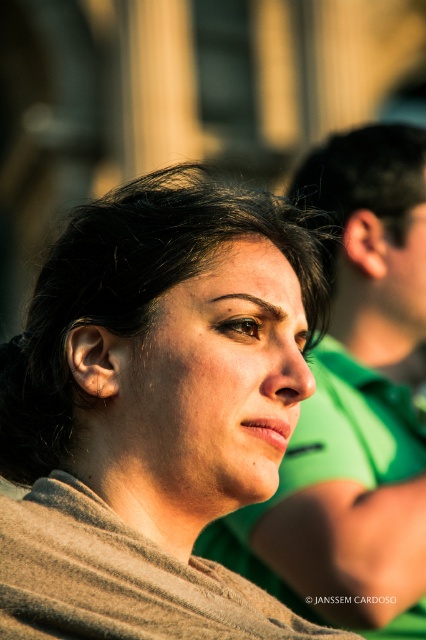
Who is positioned more to the right, green fabric shirt at right or matte black forehead at upper center?

green fabric shirt at right

Is green fabric shirt at right shorter than matte black forehead at upper center?

No, green fabric shirt at right is not shorter than matte black forehead at upper center.

Is point (377, 595) farther from camera compared to point (215, 292)?

That is True.

Image resolution: width=426 pixels, height=640 pixels. Find the location of `green fabric shirt at right`. green fabric shirt at right is located at coordinates (351, 406).

Is matte skin face at center closer to the viewer compared to dark brown hair at upper center?

Yes, it is in front of dark brown hair at upper center.

Can you confirm if matte skin face at center is positioned above dark brown hair at upper center?

No, matte skin face at center is not above dark brown hair at upper center.

Does point (304, 388) lie behind point (276, 308)?

No, (304, 388) is in front of (276, 308).

Find the location of a particular element. The image size is (426, 640). matte skin face at center is located at coordinates (210, 388).

Is matte black forehead at upper center taller than dark brown hair at upper center?

Yes.

Describe the element at coordinates (244, 282) in the screenshot. I see `matte black forehead at upper center` at that location.

This screenshot has height=640, width=426. Find the location of `matte black forehead at upper center`. matte black forehead at upper center is located at coordinates tap(244, 282).